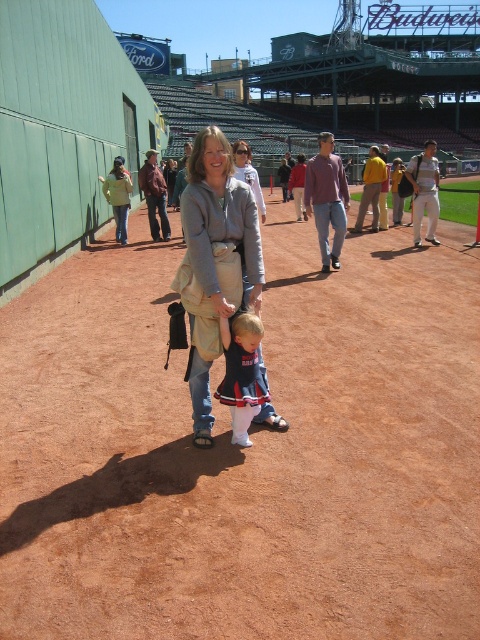
Is brown dirt field at center closer to the viewer compared to matte gray sweatshirt at center?

That is True.

Can you confirm if brown dirt field at center is positioned to the right of matte gray sweatshirt at center?

No, brown dirt field at center is not to the right of matte gray sweatshirt at center.

What do you see at coordinates (245, 451) in the screenshot? Image resolution: width=480 pixels, height=640 pixels. I see `brown dirt field at center` at bounding box center [245, 451].

Identify the location of brown dirt field at center. (245, 451).

Is matte gray sweatshirt at center closer to the viewer compared to light brown leather jacket at center?

Yes, matte gray sweatshirt at center is closer to the viewer.

Can you confirm if matte gray sweatshirt at center is positioned to the right of light brown leather jacket at center?

In fact, matte gray sweatshirt at center is to the left of light brown leather jacket at center.

Which is in front, point (224, 340) or point (326, 209)?

Point (224, 340)

Locate an element on the screen. The width and height of the screenshot is (480, 640). matte gray sweatshirt at center is located at coordinates (219, 221).

Between matte gray hoodie at center and matte gray sweatshirt at center, which one appears on the right side from the viewer's perspective?

Positioned to the right is matte gray sweatshirt at center.

Is point (228, 148) positioned after point (197, 150)?

Yes, point (228, 148) is farther from viewer.

Where is `matte gray hoodie at center`? matte gray hoodie at center is located at coordinates click(x=216, y=264).